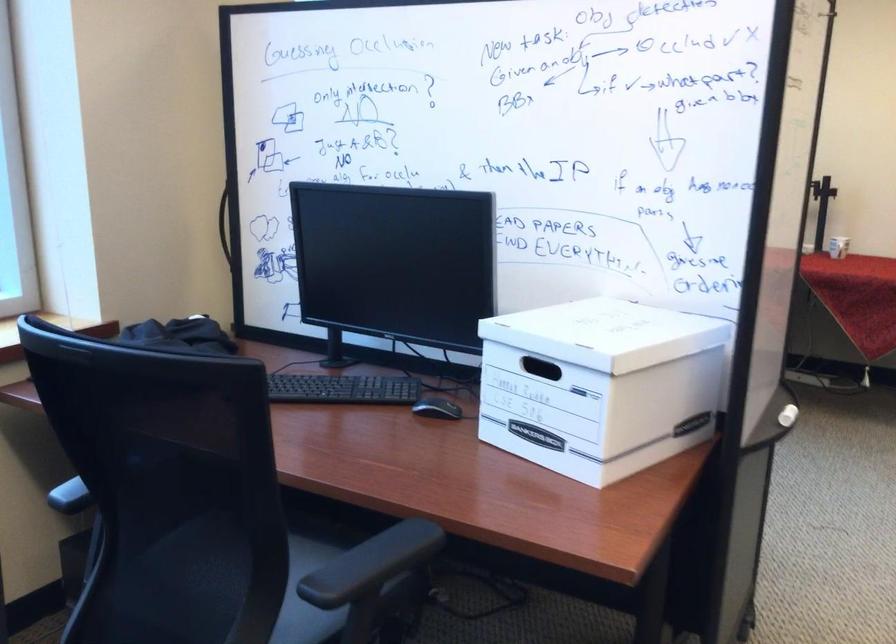
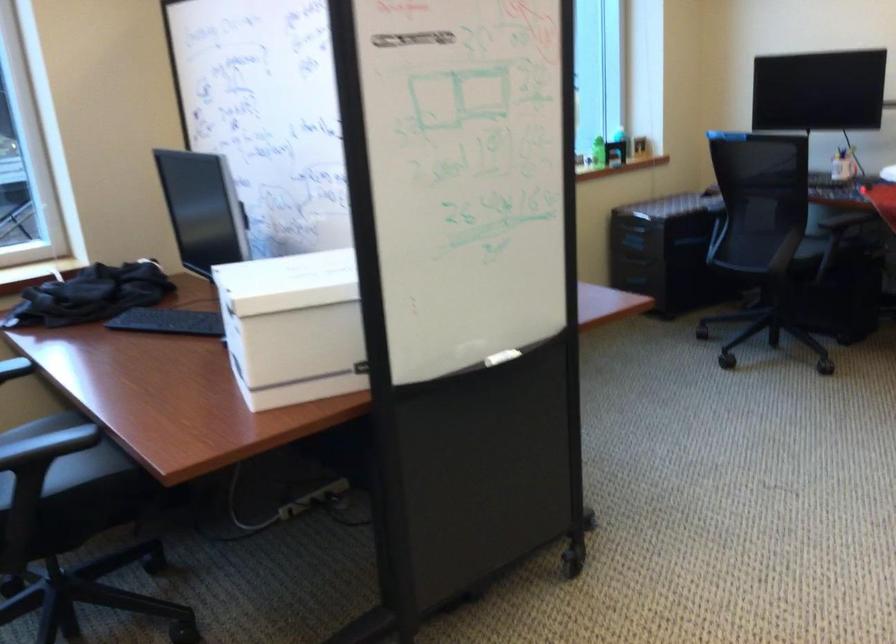
Find the pixel in the second image that matches point 402,561 in the first image.

(47, 446)